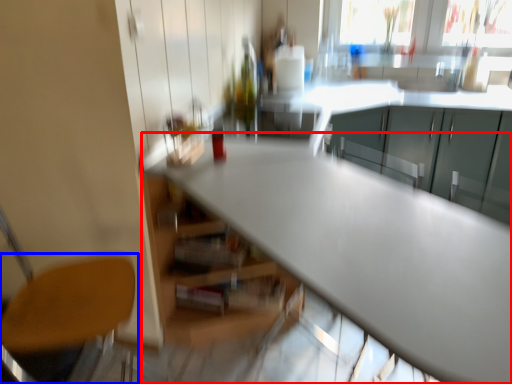
Question: Which point is closer to the camera, table (highlighted by a red box) or chair (highlighted by a blue box)?

Choices:
 (A) table
 (B) chair

Answer: (A)